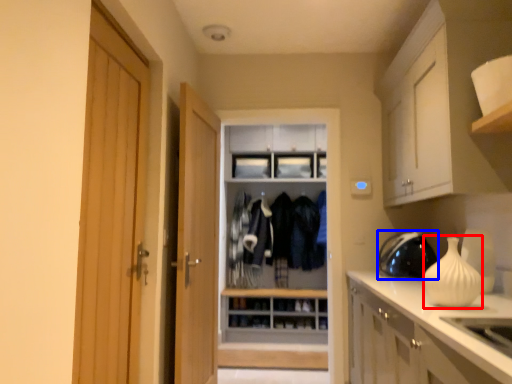
Question: Which of the following is the farthest to the observer, vase (highlighted by a red box) or appliance (highlighted by a blue box)?

Choices:
 (A) vase
 (B) appliance

Answer: (B)